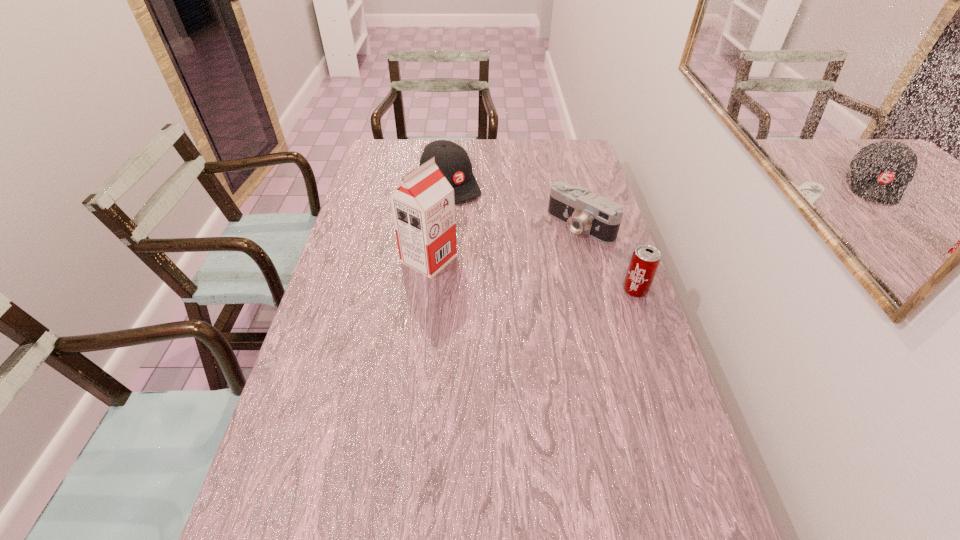
Locate an element on the screen. free space between the camera and the nearest object is located at coordinates (608, 258).

Find the location of a particular element. vacant space that is in between the soya milk and the beer can is located at coordinates (532, 275).

Find the location of a particular element. This screenshot has width=960, height=540. vacant area between the soya milk and the nearest object is located at coordinates (532, 275).

Locate an element on the screen. This screenshot has height=540, width=960. empty space between the baseball cap and the nearest object is located at coordinates click(x=542, y=237).

At what (x,y) coordinates should I click in order to perform the action: click on vacant space that's between the tallest object and the camera. Please return your answer as a coordinate pair (x, y). This screenshot has width=960, height=540. Looking at the image, I should click on (505, 242).

This screenshot has width=960, height=540. Find the location of `vacant space that is in between the farthest object and the beer can`. vacant space that is in between the farthest object and the beer can is located at coordinates (542, 237).

At what (x,y) coordinates should I click in order to perform the action: click on unoccupied area between the beer can and the shortest object. Please return your answer as a coordinate pair (x, y). This screenshot has width=960, height=540. Looking at the image, I should click on (608, 258).

This screenshot has height=540, width=960. In order to click on vacant area that lies between the camera and the beer can in this screenshot , I will do `click(608, 258)`.

Identify which object is located as the second nearest to the farthest object. Please provide its 2D coordinates. Your answer should be formatted as a tuple, i.e. [(x, y)], where the tuple contains the x and y coordinates of a point satisfying the conditions above.

[(598, 217)]

Point out which object is positioned as the third nearest to the farthest object. Please provide its 2D coordinates. Your answer should be formatted as a tuple, i.e. [(x, y)], where the tuple contains the x and y coordinates of a point satisfying the conditions above.

[(645, 260)]